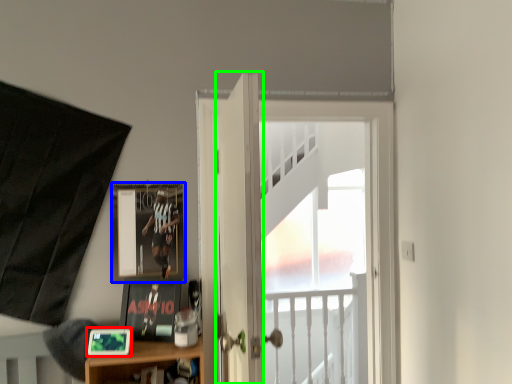
Question: Which is nearer to the picture frame (highlighted by a red box)? picture frame (highlighted by a blue box) or door (highlighted by a green box).

Choices:
 (A) picture frame
 (B) door

Answer: (A)